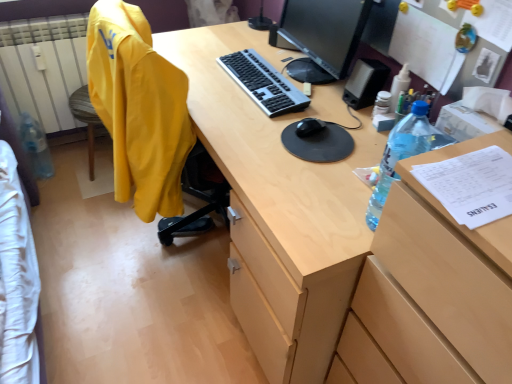
Find the location of a particular element. free space between translucent plastic bottle at right, which appears as the first bottle when viewed from the front, and black plastic speaker at upper right is located at coordinates [x=360, y=148].